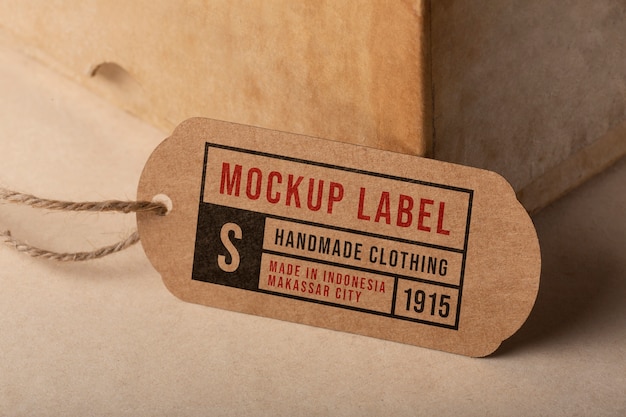
Identify the location of wooden box in behind tag. (347, 90).